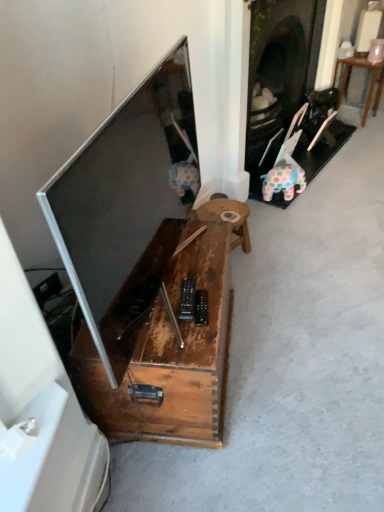
Question: From the image's perspective, relative to rustic wood table at center, the 1th table when ordered from front to back, is wooden table at right, the first table positioned from the right, above or below?

Choices:
 (A) below
 (B) above

Answer: (B)

Question: Is wooden table at right, the first table in the back-to-front sequence, in front of or behind rustic wood table at center, positioned as the 1th table in bottom-to-top order, in the image?

Choices:
 (A) front
 (B) behind

Answer: (B)

Question: Which is farther from the wooden table at right, the second table from the front?

Choices:
 (A) rustic wood table at center, which is counted as the second table, starting from the right
 (B) matte black tv at left
 (C) rustic wood coffee table at center

Answer: (C)

Question: Which object is the farthest from the wooden table at right, the first table positioned from the right?

Choices:
 (A) matte black tv at left
 (B) rustic wood table at center, which appears as the first table when viewed from the left
 (C) rustic wood coffee table at center

Answer: (C)